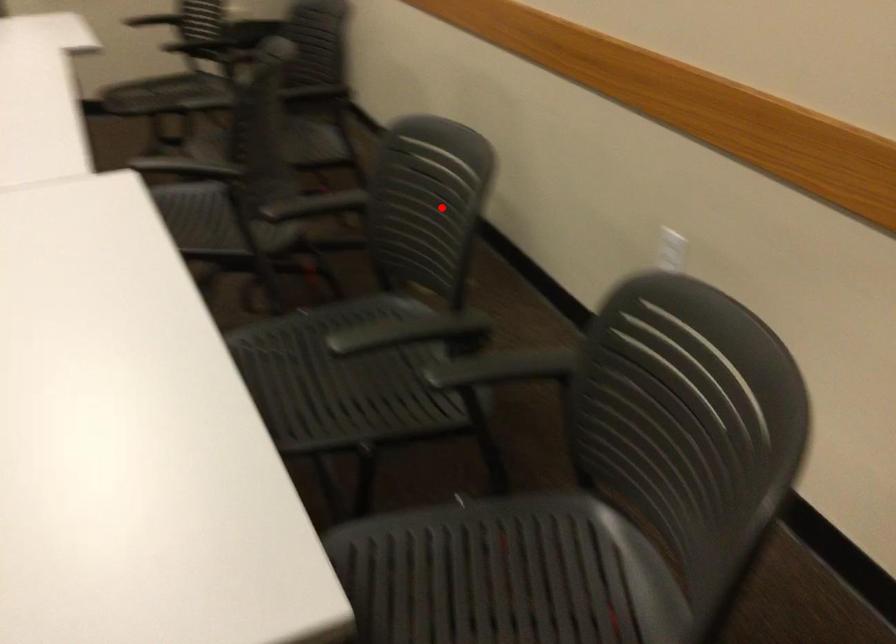
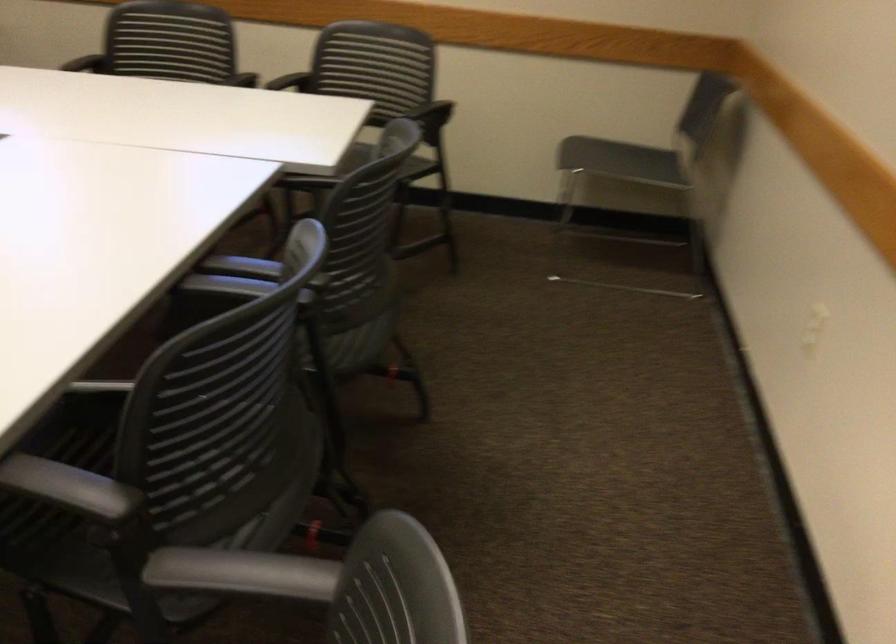
Question: I am providing you with two images of the same scene from different viewpoints. In image1, a red point is highlighted. Considering the same 3D point in image2, which of the following is correct?

Choices:
 (A) It is closer
 (B) It is farther

Answer: (B)